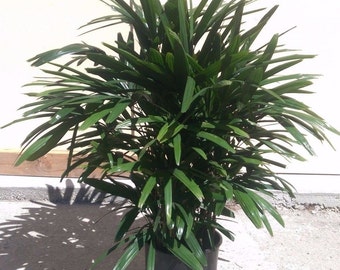
Image resolution: width=340 pixels, height=270 pixels. What are the coordinates of `platic pot` in the screenshot? It's located at (161, 259).